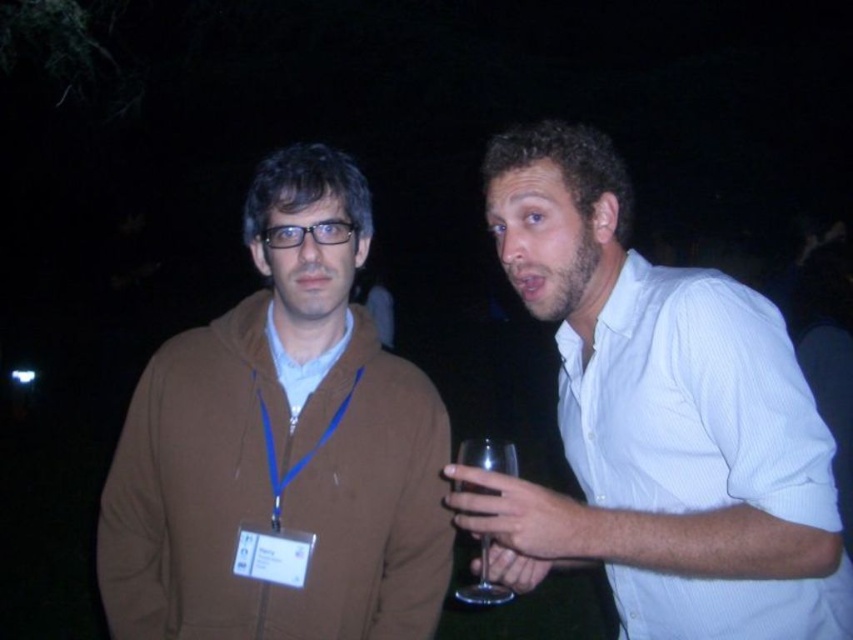
Between brown zip-up hoodie at left and transparent glass at right, which one has more height?

With more height is brown zip-up hoodie at left.

Which is more to the left, brown zip-up hoodie at left or transparent glass at right?

From the viewer's perspective, brown zip-up hoodie at left appears more on the left side.

Is point (178, 536) behind point (485, 593)?

Yes, point (178, 536) is behind point (485, 593).

Locate an element on the screen. brown zip-up hoodie at left is located at coordinates (281, 444).

From the picture: Does white textured shirt at center lie in front of transparent glass at right?

Yes, white textured shirt at center is in front of transparent glass at right.

Does point (519, 572) come closer to viewer compared to point (474, 451)?

No, (519, 572) is behind (474, 451).

Find the location of a particular element. This screenshot has width=853, height=640. white textured shirt at center is located at coordinates (657, 420).

Which is behind, point (468, 602) or point (305, 396)?

The point (305, 396) is behind.

Does transparent glass at right have a lesser height compared to matte brown shirt at center?

In fact, transparent glass at right may be taller than matte brown shirt at center.

Find the location of a particular element. transparent glass at right is located at coordinates (488, 456).